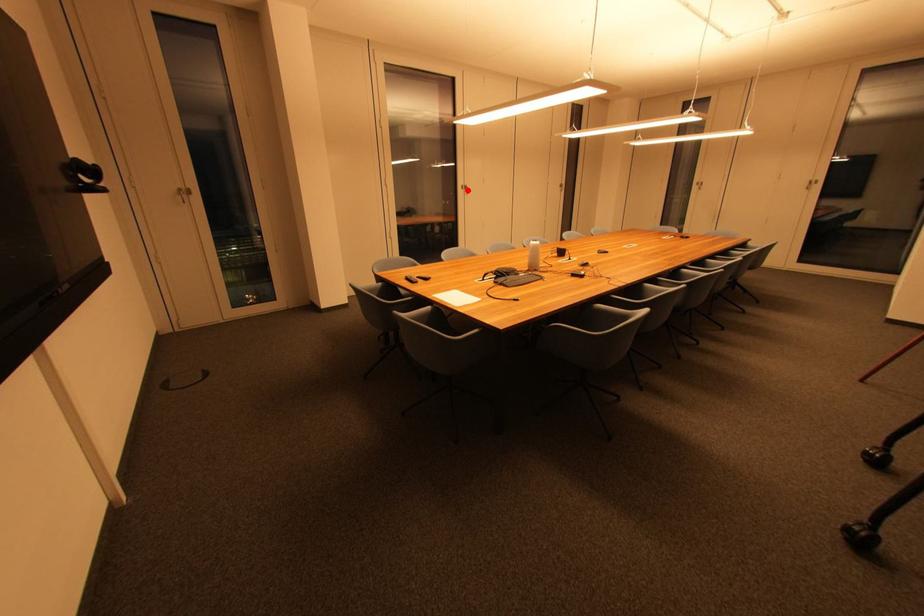
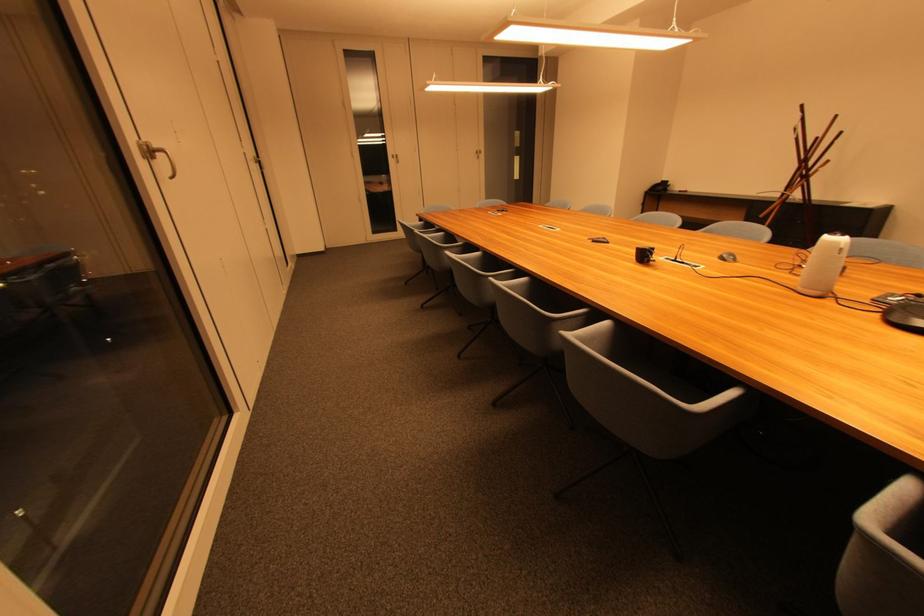
In the second image, find the point that corresponds to the highlighted location in the first image.

(148, 159)